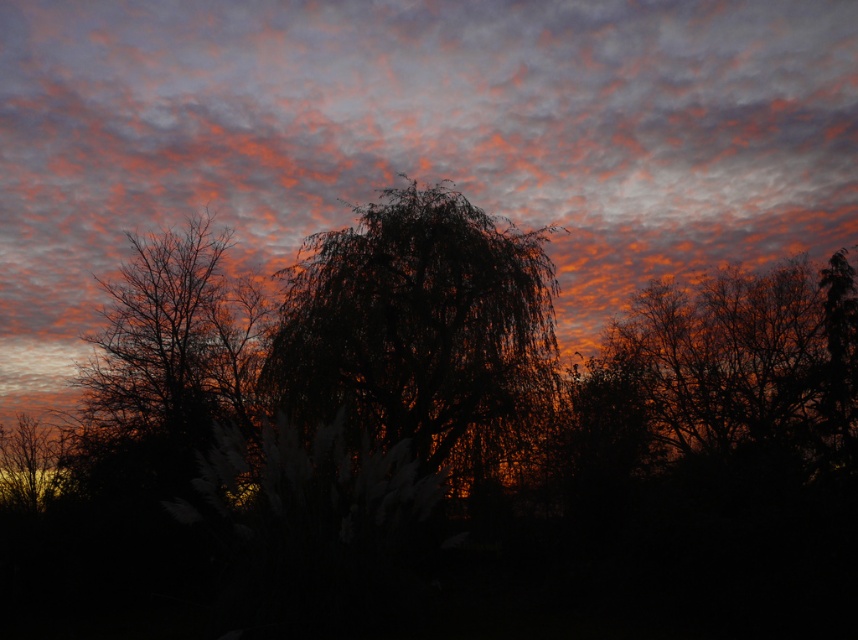
Question: Which point is closer to the camera?

Choices:
 (A) (137, 250)
 (B) (396, 291)
 (C) (831, 42)

Answer: (B)

Question: Observing the image, what is the correct spatial positioning of orange matte cloud at upper center in reference to silhouette tree at right?

Choices:
 (A) above
 (B) below

Answer: (A)

Question: Can you confirm if orange matte cloud at upper center is positioned below silhouette tree at left?

Choices:
 (A) yes
 (B) no

Answer: (B)

Question: Which of these objects is positioned closest to the silhouette tree at left?

Choices:
 (A) silhouette tree at right
 (B) dark matte tree at center

Answer: (B)

Question: Does orange matte cloud at upper center appear on the right side of silhouette tree at left?

Choices:
 (A) yes
 (B) no

Answer: (A)

Question: Among these points, which one is farthest from the camera?

Choices:
 (A) (201, 378)
 (B) (481, 99)

Answer: (B)